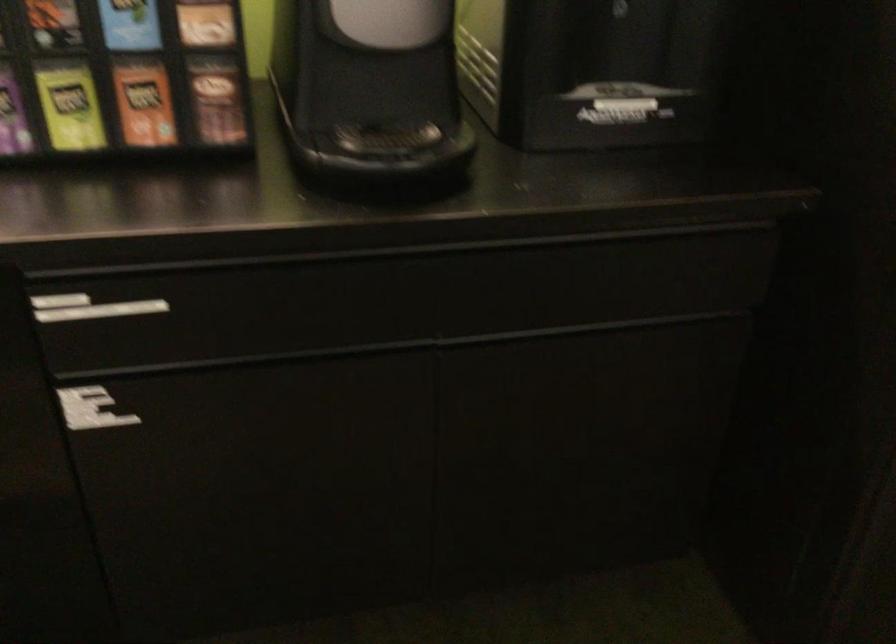
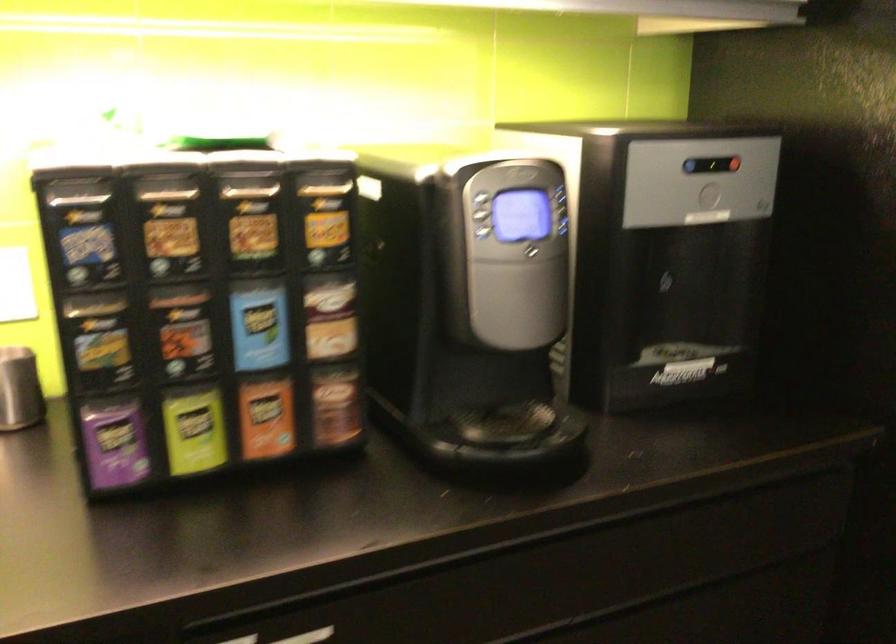
The point at (150, 303) is marked in the first image. Where is the corresponding point in the second image?

(308, 636)